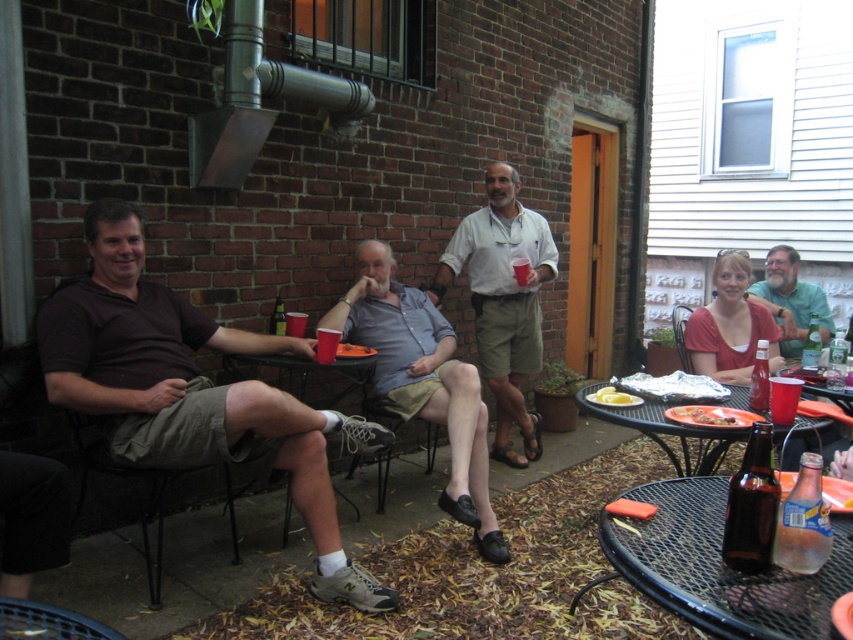
You are a guest at the gathering and want to grab the yellow matte lemon at center to make a drink. The metallic silver tray at lower right has some napkins you need. Can you reach both items without moving from your current spot if your reach is 65 centimeters?

The metallic silver tray at lower right and yellow matte lemon at center are 66.19 centimeters apart. Since your reach is only 65 centimeters, you cannot reach both items without moving.

You are at a backyard gathering and see two people wearing the gray cotton shirt at center and the green matte shirt at upper right. Which person is standing more to the left side of the other?

The gray cotton shirt at center is positioned on the left side of green matte shirt at upper right, so the person wearing the gray cotton shirt at center is more to the left.